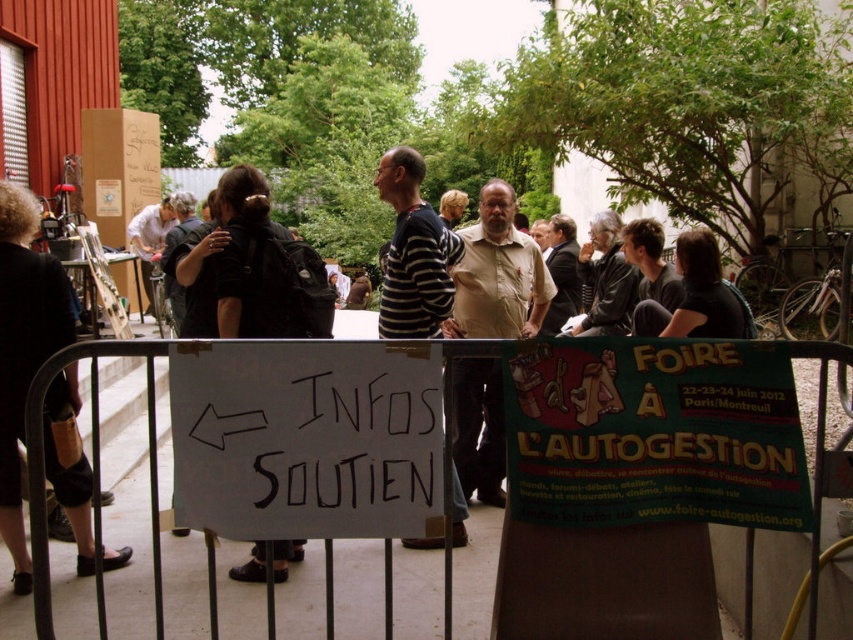
Question: Is black fabric at left above white metal fence at center?

Choices:
 (A) no
 (B) yes

Answer: (A)

Question: Is green cardboard poster at center to the left of white metal fence at center from the viewer's perspective?

Choices:
 (A) yes
 (B) no

Answer: (B)

Question: Which point is farther to the camera?

Choices:
 (A) black backpack at center
 (B) beige cotton shirt at center

Answer: (B)

Question: Which object appears closest to the camera in this image?

Choices:
 (A) black leather jacket at center
 (B) black fabric at left

Answer: (B)

Question: Is white metal fence at center smaller than black leather jacket at center?

Choices:
 (A) no
 (B) yes

Answer: (B)

Question: Which object is positioned closest to the black leather jacket at center?

Choices:
 (A) white paper sign at center
 (B) black fabric at left
 (C) beige cotton shirt at center
 (D) black backpack at center

Answer: (C)